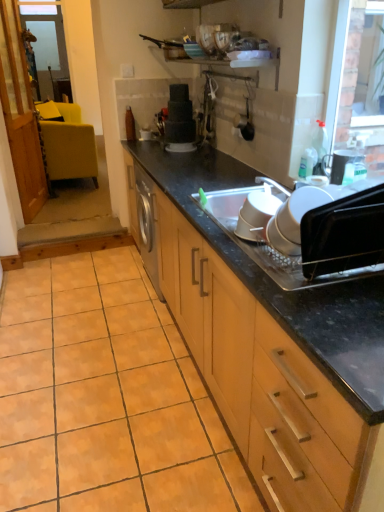
Question: Considering the relative sizes of wooden cabinet at center and transparent glass window screen at upper left in the image provided, is wooden cabinet at center thinner than transparent glass window screen at upper left?

Choices:
 (A) no
 (B) yes

Answer: (A)

Question: Does wooden cabinet at center touch transparent glass window screen at upper left?

Choices:
 (A) yes
 (B) no

Answer: (B)

Question: From the image's perspective, is wooden cabinet at center on top of transparent glass window screen at upper left?

Choices:
 (A) yes
 (B) no

Answer: (B)

Question: Considering the relative positions of wooden cabinet at center and transparent glass window screen at upper left in the image provided, is wooden cabinet at center to the left of transparent glass window screen at upper left from the viewer's perspective?

Choices:
 (A) no
 (B) yes

Answer: (A)

Question: Is wooden cabinet at center positioned with its back to transparent glass window screen at upper left?

Choices:
 (A) no
 (B) yes

Answer: (A)

Question: Is wooden cabinet at center not near transparent glass window screen at upper left?

Choices:
 (A) no
 (B) yes

Answer: (B)

Question: Does black plastic oven at right, acting as the 2th appliance starting from the right, appear on the left side of orange matte tile at lower left?

Choices:
 (A) no
 (B) yes

Answer: (A)

Question: Is black plastic oven at right, placed as the third appliance when sorted from left to right, positioned behind orange matte tile at lower left?

Choices:
 (A) no
 (B) yes

Answer: (A)

Question: Does black plastic oven at right, the first appliance viewed from the front, have a greater height compared to orange matte tile at lower left?

Choices:
 (A) yes
 (B) no

Answer: (A)

Question: Can we say black plastic oven at right, placed as the third appliance when sorted from left to right, lies outside orange matte tile at lower left?

Choices:
 (A) no
 (B) yes

Answer: (B)

Question: Are black plastic oven at right, the first appliance viewed from the front, and orange matte tile at lower left located far from each other?

Choices:
 (A) yes
 (B) no

Answer: (A)

Question: From the image's perspective, is black plastic oven at right, the first appliance viewed from the front, above orange matte tile at lower left?

Choices:
 (A) no
 (B) yes

Answer: (B)

Question: Is black plastic oven at right, the fourth appliance from the top, facing away from white plastic bowls at center, marked as the second appliance in a left-to-right arrangement?

Choices:
 (A) no
 (B) yes

Answer: (A)